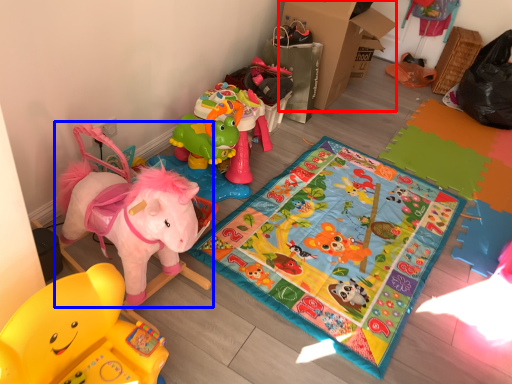
Question: Which point is further to the camera, cardboard box (highlighted by a red box) or toy (highlighted by a blue box)?

Choices:
 (A) cardboard box
 (B) toy

Answer: (A)